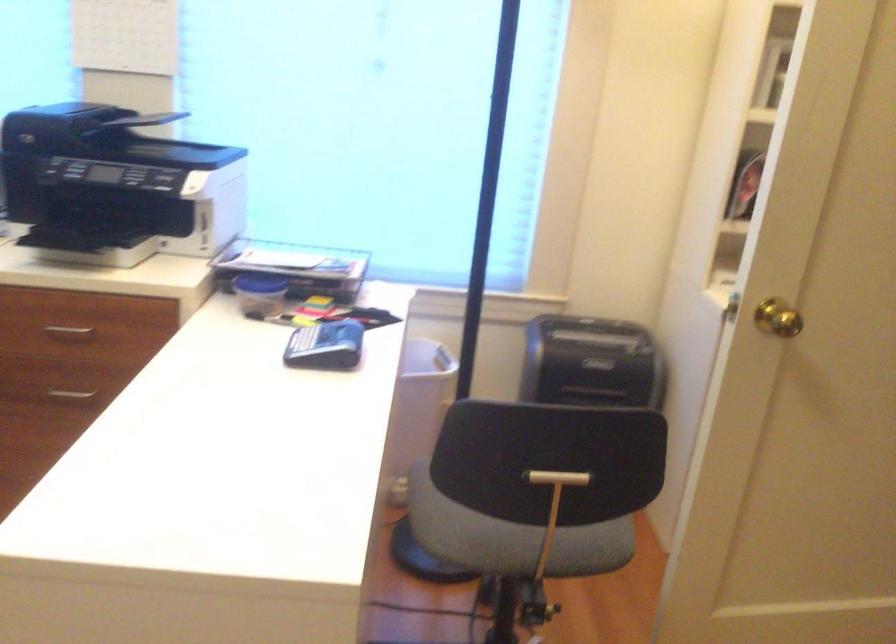
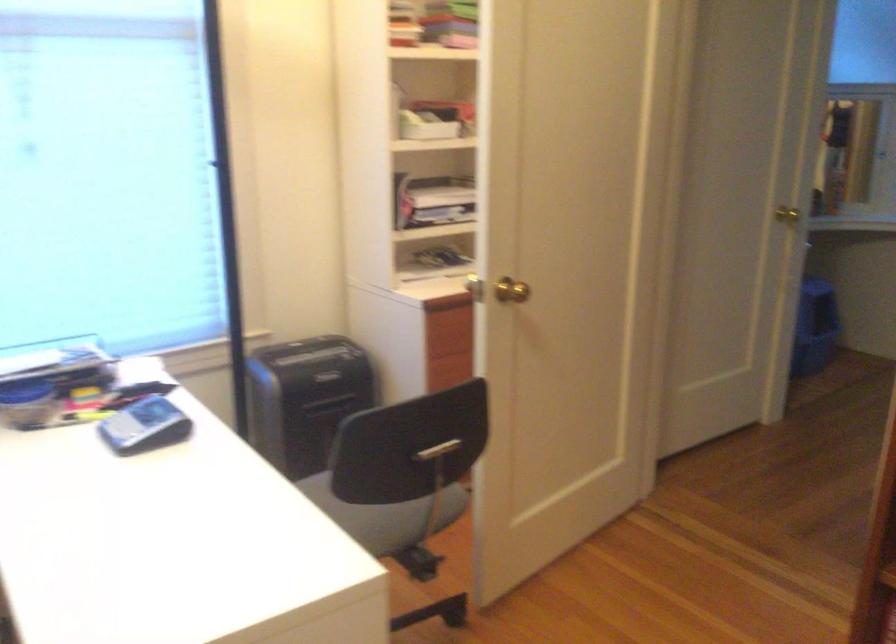
Question: The camera is either moving clockwise (left) or counter-clockwise (right) around the object. The first image is from the beginning of the video and the second image is from the end. Is the camera moving left or right when shooting the video?

Choices:
 (A) Left
 (B) Right

Answer: (A)